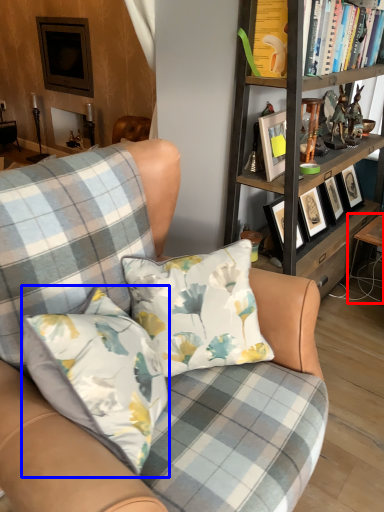
Question: Which object appears closest to the camera in this image, table (highlighted by a red box) or pillow (highlighted by a blue box)?

Choices:
 (A) table
 (B) pillow

Answer: (B)